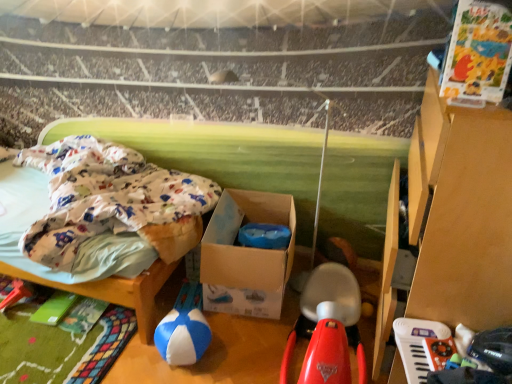
Question: From a real-world perspective, is blue/white fabric ball at center, positioned as the 3th toy in right-to-left order, located higher than white plastic keyboard at lower right, acting as the 3th toy starting from the left?

Choices:
 (A) yes
 (B) no

Answer: (B)

Question: Considering the relative positions of blue/white fabric ball at center, positioned as the 3th toy in right-to-left order, and white plastic keyboard at lower right, placed as the first toy when sorted from right to left, in the image provided, is blue/white fabric ball at center, positioned as the 3th toy in right-to-left order, behind white plastic keyboard at lower right, placed as the first toy when sorted from right to left,?

Choices:
 (A) yes
 (B) no

Answer: (A)

Question: Considering the relative sizes of blue/white fabric ball at center, the 1th toy viewed from the left, and white plastic keyboard at lower right, placed as the first toy when sorted from right to left, in the image provided, is blue/white fabric ball at center, the 1th toy viewed from the left, smaller than white plastic keyboard at lower right, placed as the first toy when sorted from right to left,?

Choices:
 (A) no
 (B) yes

Answer: (A)

Question: Can we say blue/white fabric ball at center, positioned as the 3th toy in right-to-left order, lies outside white plastic keyboard at lower right, acting as the 3th toy starting from the left?

Choices:
 (A) yes
 (B) no

Answer: (A)

Question: Can you confirm if blue/white fabric ball at center, the 1th toy viewed from the left, is thinner than white plastic keyboard at lower right, acting as the 3th toy starting from the left?

Choices:
 (A) no
 (B) yes

Answer: (A)

Question: Based on their positions, is blue/white fabric ball at center, the 1th toy viewed from the left, located to the left or right of rubberized red scooter at center, the 2th toy when ordered from left to right?

Choices:
 (A) right
 (B) left

Answer: (B)

Question: Considering the positions of point (184, 327) and point (301, 311), is point (184, 327) closer or farther from the camera than point (301, 311)?

Choices:
 (A) closer
 (B) farther

Answer: (A)

Question: Is blue/white fabric ball at center, the 1th toy viewed from the left, in front of or behind rubberized red scooter at center, the 2th toy when ordered from left to right, in the image?

Choices:
 (A) behind
 (B) front

Answer: (A)

Question: In terms of width, does blue/white fabric ball at center, the 1th toy viewed from the left, look wider or thinner when compared to rubberized red scooter at center, the 2th toy when ordered from left to right?

Choices:
 (A) thin
 (B) wide

Answer: (A)

Question: Considering the relative positions of rubberized red scooter at center, the 2th toy when ordered from left to right, and cardboard box at center in the image provided, is rubberized red scooter at center, the 2th toy when ordered from left to right, to the left or to the right of cardboard box at center?

Choices:
 (A) right
 (B) left

Answer: (A)

Question: From the image's perspective, is rubberized red scooter at center, marked as the 2th toy in a right-to-left arrangement, located above or below cardboard box at center?

Choices:
 (A) below
 (B) above

Answer: (A)

Question: Is rubberized red scooter at center, marked as the 2th toy in a right-to-left arrangement, inside the boundaries of cardboard box at center, or outside?

Choices:
 (A) inside
 (B) outside

Answer: (B)

Question: In terms of size, does rubberized red scooter at center, marked as the 2th toy in a right-to-left arrangement, appear bigger or smaller than cardboard box at center?

Choices:
 (A) big
 (B) small

Answer: (A)

Question: In terms of height, does cardboard box at center look taller or shorter compared to blue/white fabric ball at center, the 1th toy viewed from the left?

Choices:
 (A) short
 (B) tall

Answer: (B)

Question: From the image's perspective, relative to blue/white fabric ball at center, positioned as the 3th toy in right-to-left order, is cardboard box at center above or below?

Choices:
 (A) below
 (B) above

Answer: (B)